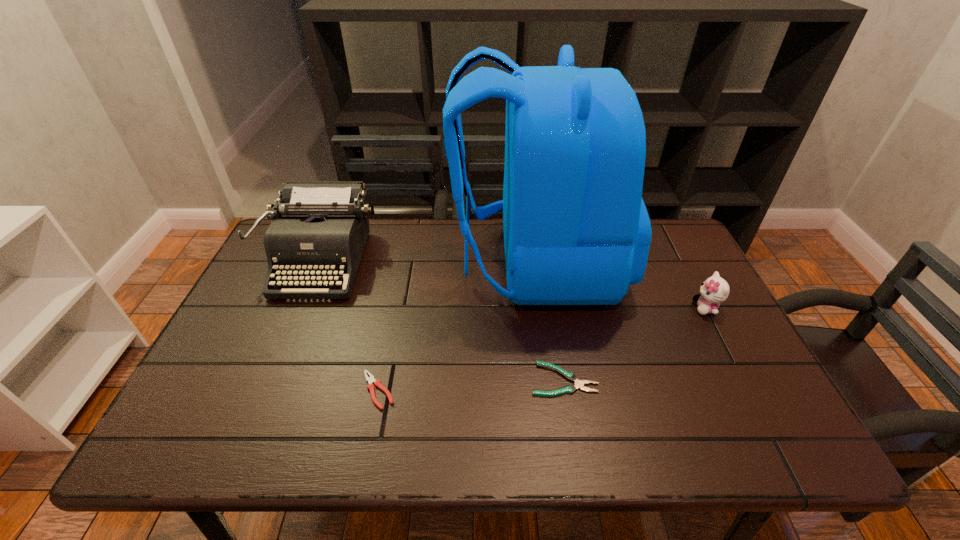
The height and width of the screenshot is (540, 960). In order to click on blank area in the image that satisfies the following two spatial constraints: 1. on the back of the tallest object; 2. on the left side of the right pliers in this screenshot , I will do `click(554, 380)`.

What are the coordinates of `vacant region that satisfies the following two spatial constraints: 1. on the front-facing side of the right pliers; 2. on the left side of the typewriter` in the screenshot? It's located at (271, 380).

Image resolution: width=960 pixels, height=540 pixels. In order to click on free space in the image that satisfies the following two spatial constraints: 1. on the back side of the right pliers; 2. on the back of the backpack in this screenshot , I will do `click(544, 262)`.

The width and height of the screenshot is (960, 540). I want to click on vacant space that satisfies the following two spatial constraints: 1. on the front-facing side of the right pliers; 2. on the left side of the second tallest object, so pyautogui.click(x=271, y=380).

Where is `free space that satisfies the following two spatial constraints: 1. on the front-facing side of the second tallest object; 2. on the left side of the fourth object from right to left`? This screenshot has width=960, height=540. free space that satisfies the following two spatial constraints: 1. on the front-facing side of the second tallest object; 2. on the left side of the fourth object from right to left is located at coordinates (266, 390).